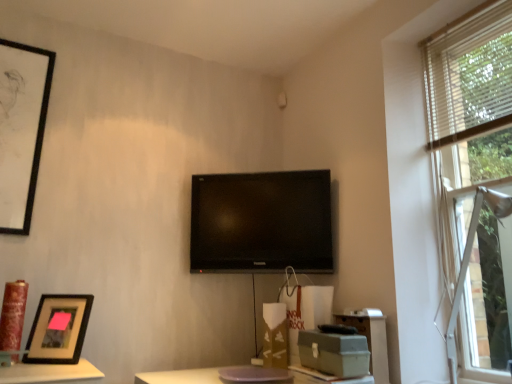
Locate an element on the screen. This screenshot has height=384, width=512. black matte picture frame at lower left, the 1th picture frame ordered from the bottom is located at coordinates (58, 329).

The image size is (512, 384). What do you see at coordinates (58, 329) in the screenshot?
I see `black matte picture frame at lower left, the 1th picture frame ordered from the bottom` at bounding box center [58, 329].

This screenshot has width=512, height=384. What do you see at coordinates (334, 353) in the screenshot? I see `matte gray cardboard box at lower right, the 1th cardboard box positioned from the front` at bounding box center [334, 353].

Image resolution: width=512 pixels, height=384 pixels. What do you see at coordinates (470, 76) in the screenshot?
I see `white wood blinds at upper right` at bounding box center [470, 76].

What do you see at coordinates (21, 129) in the screenshot? This screenshot has width=512, height=384. I see `black matte picture frame at upper left, acting as the first picture frame starting from the left` at bounding box center [21, 129].

Identify the location of black matte picture frame at upper left, positioned as the second picture frame in front-to-back order. (21, 129).

You are a GUI agent. You are given a task and a screenshot of the screen. Output one action in this format:
    pyautogui.click(x=<x>, y=<y>)
    Task: Click on the brown cardboard box at center, which is the second cardboard box in right-to-left order
    
    Given the screenshot: What is the action you would take?
    pyautogui.click(x=275, y=336)

Is black glossy tv at center inside or outside of matte gray cardboard box at lower right, which is counted as the 2th cardboard box, starting from the left?

black glossy tv at center is outside matte gray cardboard box at lower right, which is counted as the 2th cardboard box, starting from the left.

Between black glossy tv at center and matte gray cardboard box at lower right, the 1th cardboard box positioned from the front, which one has larger size?

black glossy tv at center is bigger.

From a real-world perspective, is black glossy tv at center on top of matte gray cardboard box at lower right, which is counted as the 2th cardboard box, starting from the left?

Yes, from a real-world perspective, black glossy tv at center is on top of matte gray cardboard box at lower right, which is counted as the 2th cardboard box, starting from the left.

Considering the relative sizes of black glossy tv at center and matte gray cardboard box at lower right, the 1th cardboard box positioned from the front, in the image provided, is black glossy tv at center shorter than matte gray cardboard box at lower right, the 1th cardboard box positioned from the front,?

No.

Is black matte picture frame at upper left, the 1th picture frame positioned from the top, facing away from white wood blinds at upper right?

No, black matte picture frame at upper left, the 1th picture frame positioned from the top, is not facing the opposite direction of white wood blinds at upper right.

How far apart are black matte picture frame at upper left, positioned as the second picture frame in front-to-back order, and white wood blinds at upper right?

black matte picture frame at upper left, positioned as the second picture frame in front-to-back order, is 6.75 feet from white wood blinds at upper right.

Consider the image. How different are the orientations of black matte picture frame at upper left, which is counted as the second picture frame, starting from the bottom, and white wood blinds at upper right in degrees?

There is a 89-degree angle between the facing directions of black matte picture frame at upper left, which is counted as the second picture frame, starting from the bottom, and white wood blinds at upper right.

Which is closer, (37, 164) or (496, 56)?

Clearly, point (37, 164) is more distant from the camera than point (496, 56).

From a real-world perspective, who is located lower, white wood blinds at upper right or black matte picture frame at upper left, which is counted as the 1th picture frame, starting from the back?

black matte picture frame at upper left, which is counted as the 1th picture frame, starting from the back, from a real-world perspective.

From the image's perspective, is white wood blinds at upper right under black matte picture frame at upper left, positioned as the second picture frame in front-to-back order?

No.

From the picture: Which object is wider, white wood blinds at upper right or black matte picture frame at upper left, which is counted as the 1th picture frame, starting from the back?

black matte picture frame at upper left, which is counted as the 1th picture frame, starting from the back, is wider.

Is black glossy tv at center at the right side of white plastic window at right?

Incorrect, black glossy tv at center is not on the right side of white plastic window at right.

Does point (293, 186) come farther from viewer compared to point (464, 269)?

Yes.

Could white plastic window at right be considered to be inside black glossy tv at center?

No, black glossy tv at center does not contain white plastic window at right.

Considering the relative sizes of white wood blinds at upper right and black glossy tv at center in the image provided, is white wood blinds at upper right bigger than black glossy tv at center?

No, white wood blinds at upper right is not bigger than black glossy tv at center.

How many degrees apart are the facing directions of white wood blinds at upper right and black glossy tv at center?

white wood blinds at upper right and black glossy tv at center are facing 50.2 degrees away from each other.

From a real-world perspective, is white wood blinds at upper right positioned above or below black glossy tv at center?

From a real-world perspective, white wood blinds at upper right is physically above black glossy tv at center.

Is there a large distance between white wood blinds at upper right and black glossy tv at center?

No, white wood blinds at upper right is in close proximity to black glossy tv at center.

How different are the orientations of matte gray cardboard box at lower right, positioned as the 2th cardboard box in back-to-front order, and black matte picture frame at lower left, which is counted as the first picture frame, starting from the right, in degrees?

53.7 degrees.

From a real-world perspective, is matte gray cardboard box at lower right, marked as the first cardboard box in a right-to-left arrangement, above or below black matte picture frame at lower left, which is counted as the first picture frame, starting from the right?

From a real-world perspective, matte gray cardboard box at lower right, marked as the first cardboard box in a right-to-left arrangement, is physically below black matte picture frame at lower left, which is counted as the first picture frame, starting from the right.

Which is in front, matte gray cardboard box at lower right, positioned as the 2th cardboard box in back-to-front order, or black matte picture frame at lower left, arranged as the 2th picture frame when viewed from the top?

Positioned in front is matte gray cardboard box at lower right, positioned as the 2th cardboard box in back-to-front order.

Are matte gray cardboard box at lower right, the 1th cardboard box positioned from the front, and black matte picture frame at lower left, which is counted as the second picture frame, starting from the back, making contact?

There is a gap between matte gray cardboard box at lower right, the 1th cardboard box positioned from the front, and black matte picture frame at lower left, which is counted as the second picture frame, starting from the back.

Considering the relative sizes of brown cardboard box at center, positioned as the 1th cardboard box in back-to-front order, and black glossy tv at center in the image provided, is brown cardboard box at center, positioned as the 1th cardboard box in back-to-front order, thinner than black glossy tv at center?

In fact, brown cardboard box at center, positioned as the 1th cardboard box in back-to-front order, might be wider than black glossy tv at center.

Looking at this image, can you confirm if brown cardboard box at center, which is the second cardboard box in right-to-left order, is bigger than black glossy tv at center?

No.

Could you measure the distance between brown cardboard box at center, positioned as the 1th cardboard box in back-to-front order, and black glossy tv at center?

18.11 inches.

Is black glossy tv at center completely or partially inside brown cardboard box at center, positioned as the 1th cardboard box in back-to-front order?

No, black glossy tv at center is not inside brown cardboard box at center, positioned as the 1th cardboard box in back-to-front order.

You are a GUI agent. You are given a task and a screenshot of the screen. Output one action in this format:
    pyautogui.click(x=<x>, y=<y>)
    Task: Click on the cardboard box that is the 1st one when counting downward from the black glossy tv at center (from the image's perspective)
    
    Given the screenshot: What is the action you would take?
    pyautogui.click(x=334, y=353)

Locate an element on the screen. blind located on the right of black matte picture frame at upper left, acting as the first picture frame starting from the left is located at coordinates (470, 76).

Which object lies further to the anchor point matte gray cardboard box at lower right, marked as the first cardboard box in a right-to-left arrangement, brown cardboard box at center, arranged as the 1th cardboard box when viewed from the left, or white plastic window at right?

Among the two, white plastic window at right is located further to matte gray cardboard box at lower right, marked as the first cardboard box in a right-to-left arrangement.

From the image, which object appears to be farther from wooden frame at right, brown cardboard box at center, which is the second cardboard box in right-to-left order, or matte gray cardboard box at lower right, which is counted as the 2th cardboard box, starting from the left?

The object further to wooden frame at right is brown cardboard box at center, which is the second cardboard box in right-to-left order.

Considering their positions, is brown cardboard box at center, positioned as the 1th cardboard box in back-to-front order, positioned further to white plastic window at right than matte gray file cabinet at lower right?

Among the two, brown cardboard box at center, positioned as the 1th cardboard box in back-to-front order, is located further to white plastic window at right.

Looking at the image, which one is located further to white wood blinds at upper right, matte gray file cabinet at lower right or brown cardboard box at center, positioned as the 1th cardboard box in back-to-front order?

brown cardboard box at center, positioned as the 1th cardboard box in back-to-front order.

Estimate the real-world distances between objects in this image. Which object is closer to matte gray cardboard box at lower right, the 1th cardboard box positioned from the front, black matte picture frame at lower left, arranged as the 2th picture frame when viewed from the top, or wooden frame at right?

wooden frame at right is positioned closer to the anchor matte gray cardboard box at lower right, the 1th cardboard box positioned from the front.

Which object lies nearer to the anchor point black matte picture frame at lower left, which is counted as the first picture frame, starting from the right, black matte picture frame at upper left, which is counted as the second picture frame, starting from the bottom, or matte gray file cabinet at lower right?

Among the two, black matte picture frame at upper left, which is counted as the second picture frame, starting from the bottom, is located nearer to black matte picture frame at lower left, which is counted as the first picture frame, starting from the right.

From the image, which object appears to be farther from matte gray cardboard box at lower right, the 1th cardboard box positioned from the front, black glossy tv at center or white plastic window at right?

The object further to matte gray cardboard box at lower right, the 1th cardboard box positioned from the front, is black glossy tv at center.

Considering their positions, is white wood blinds at upper right positioned further to white plastic window at right than black glossy tv at center?

black glossy tv at center is positioned further to the anchor white plastic window at right.

You are a GUI agent. You are given a task and a screenshot of the screen. Output one action in this format:
    pyautogui.click(x=<x>, y=<y>)
    Task: Click on the bay window between white wood blinds at upper right and brown cardboard box at center, which is counted as the 2th cardboard box, starting from the front, in the vertical direction
    This screenshot has width=512, height=384.
    Given the screenshot: What is the action you would take?
    pos(468,264)

Where is `window between white wood blinds at upper right and white plastic window at right from top to bottom`? window between white wood blinds at upper right and white plastic window at right from top to bottom is located at coordinates pos(475,173).

Find the location of a particular element. Image resolution: width=512 pixels, height=384 pixels. bay window between white wood blinds at upper right and matte gray file cabinet at lower right from top to bottom is located at coordinates (468, 264).

Where is `cardboard box that lies between white wood blinds at upper right and matte gray file cabinet at lower right from top to bottom`? Image resolution: width=512 pixels, height=384 pixels. cardboard box that lies between white wood blinds at upper right and matte gray file cabinet at lower right from top to bottom is located at coordinates (334, 353).